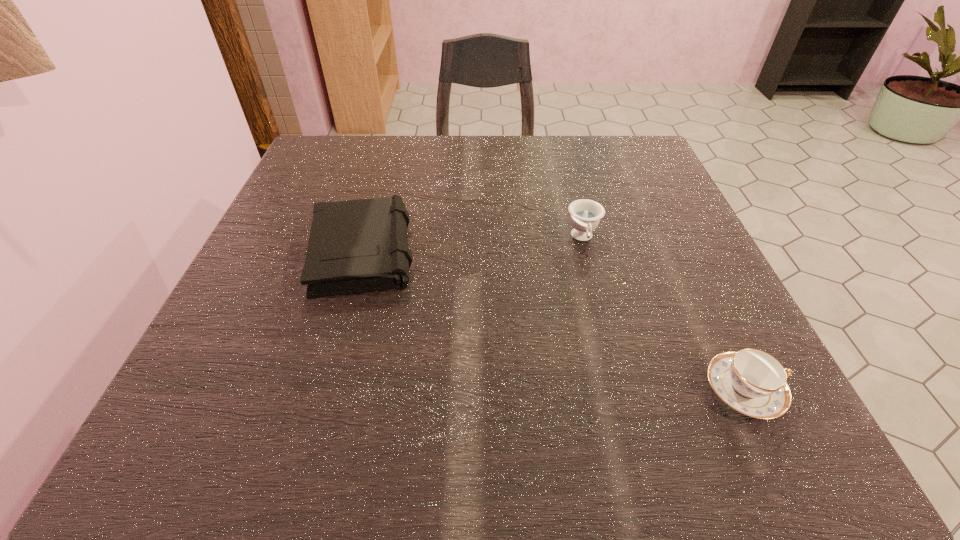
Identify the location of object that is at the near right corner. (751, 381).

Where is `free region at the far edge of the desktop`? The image size is (960, 540). free region at the far edge of the desktop is located at coordinates (520, 162).

You are a GUI agent. You are given a task and a screenshot of the screen. Output one action in this format:
    pyautogui.click(x=<x>, y=<y>)
    Task: Click on the vacant region at the near edge of the desktop
    The image size is (960, 540).
    Given the screenshot: What is the action you would take?
    pyautogui.click(x=533, y=417)

Locate an element on the screen. This screenshot has width=960, height=540. vacant space at the left edge of the desktop is located at coordinates (272, 226).

Where is `free location at the right edge`? The height and width of the screenshot is (540, 960). free location at the right edge is located at coordinates (623, 241).

Identify the location of vacant space at the far left corner of the desktop. The image size is (960, 540). (358, 170).

The image size is (960, 540). I want to click on vacant point at the near left corner, so click(277, 440).

The width and height of the screenshot is (960, 540). What are the coordinates of `vacant area at the far right corner of the desktop` in the screenshot? It's located at (641, 186).

The width and height of the screenshot is (960, 540). Identify the location of vacant space at the near right corner of the desktop. (714, 401).

I want to click on free space between the leftmost object and the right teacup, so click(554, 320).